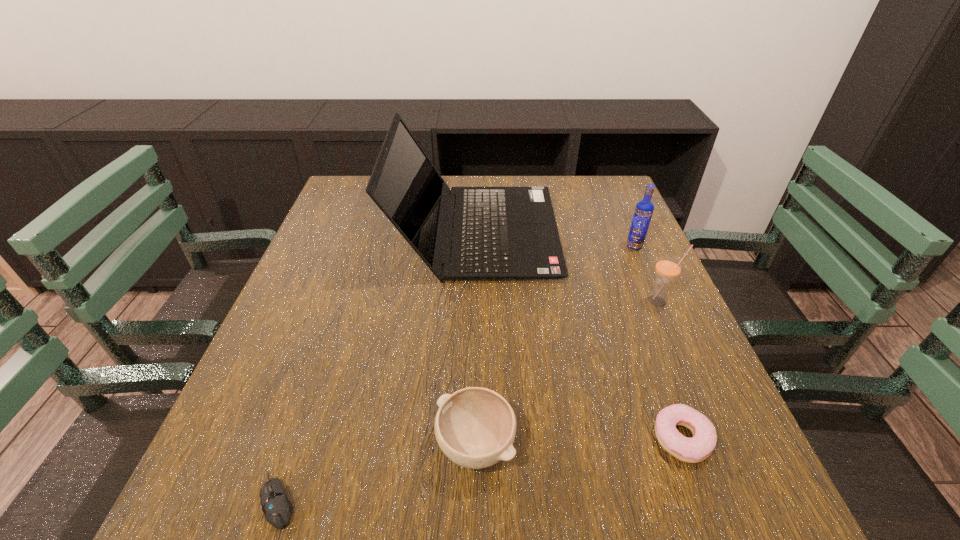
You are a GUI agent. You are given a task and a screenshot of the screen. Output one action in this format:
    pyautogui.click(x=<x>, y=<y>)
    Task: Click on the empty space that is in between the doughnut and the third farthest object
    
    Given the screenshot: What is the action you would take?
    pyautogui.click(x=670, y=369)

This screenshot has width=960, height=540. What are the coordinates of `vacant space that is in between the tallest object and the doughnut` in the screenshot? It's located at (579, 335).

I want to click on vacant region between the fifth tallest object and the tallest object, so click(579, 335).

This screenshot has width=960, height=540. In order to click on vacant area that lies between the third farthest object and the doughnut in this screenshot , I will do `click(670, 369)`.

You are a GUI agent. You are given a task and a screenshot of the screen. Output one action in this format:
    pyautogui.click(x=<x>, y=<y>)
    Task: Click on the unoccupied area between the tallest object and the bowl
    
    Given the screenshot: What is the action you would take?
    pyautogui.click(x=475, y=338)

Locate which object is the fourth closest to the second shortest object. Please provide its 2D coordinates. Your answer should be formatted as a tuple, i.e. [(x, y)], where the tuple contains the x and y coordinates of a point satisfying the conditions above.

[(644, 209)]

Locate an element on the screen. This screenshot has height=540, width=960. object that is the fifth closest to the fourth nearest object is located at coordinates (277, 508).

At what (x,y) coordinates should I click in order to perform the action: click on free location that satisfies the following two spatial constraints: 1. on the screen of the vodka; 2. on the right side of the laptop computer. Please return your answer as a coordinate pair (x, y). Looking at the image, I should click on coord(475,246).

In order to click on vacant area that satisfies the following two spatial constraints: 1. on the screen of the fourth tallest object; 2. on the left side of the tallest object in this screenshot , I will do `click(472, 445)`.

At what (x,y) coordinates should I click in order to perform the action: click on free space that satisfies the following two spatial constraints: 1. on the screen of the laptop computer; 2. on the back side of the straw. Please return your answer as a coordinate pair (x, y). The height and width of the screenshot is (540, 960). Looking at the image, I should click on (474, 301).